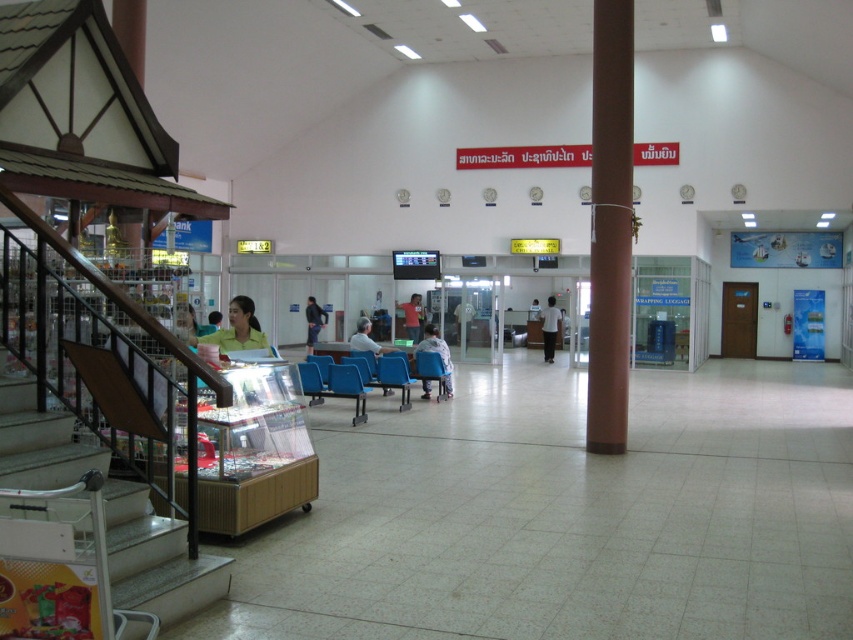
Question: Can you confirm if brown polished column at center is positioned above light blue fabric chair at center?

Choices:
 (A) no
 (B) yes

Answer: (B)

Question: Which point is closer to the camera taking this photo?

Choices:
 (A) (399, 307)
 (B) (604, 225)
 (C) (316, 316)
 (D) (369, 326)

Answer: (B)

Question: Can you confirm if metallic gray staircase at lower left is positioned below light brown leather jacket at center?

Choices:
 (A) no
 (B) yes

Answer: (B)

Question: Which object is positioned closest to the white shirt at center?

Choices:
 (A) metallic gray staircase at lower left
 (B) brown polished column at center
 (C) light blue fabric chair at center

Answer: (C)

Question: Considering the real-world distances, which object is farthest from the metallic gray staircase at lower left?

Choices:
 (A) light brown leather jacket at center
 (B) light blue fabric chair at center
 (C) matte blue chair at center
 (D) dark blue jeans at center

Answer: (D)

Question: Does matte blue chair at center appear over light brown leather jacket at center?

Choices:
 (A) yes
 (B) no

Answer: (B)